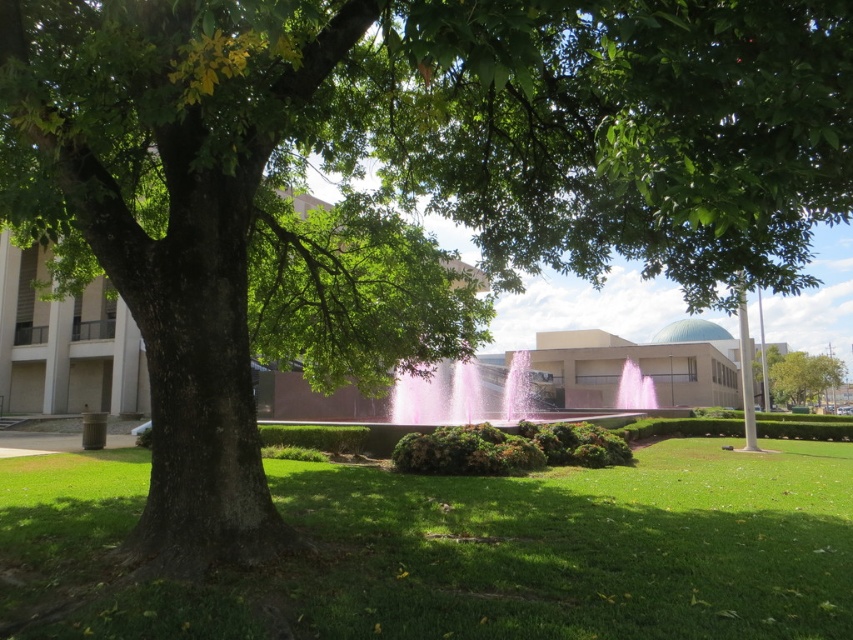
Question: Is the position of green grass at lower center less distant than that of green leafy tree at right?

Choices:
 (A) yes
 (B) no

Answer: (A)

Question: Which point is closer to the camera?

Choices:
 (A) (775, 400)
 (B) (724, 548)

Answer: (B)

Question: Is green grass at lower center above green leafy tree at right?

Choices:
 (A) no
 (B) yes

Answer: (B)

Question: Where is green grass at lower center located in relation to green leafy tree at right in the image?

Choices:
 (A) above
 (B) below

Answer: (A)

Question: Which object is farther from the camera taking this photo?

Choices:
 (A) green leafy tree at right
 (B) green grass at lower center

Answer: (A)